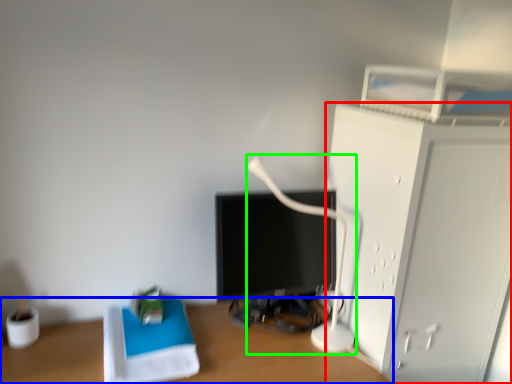
Question: Estimate the real-world distances between objects in this image. Which object is closer to furniture (highlighted by a red box), desk (highlighted by a blue box) or table lamp (highlighted by a green box)?

Choices:
 (A) desk
 (B) table lamp

Answer: (B)